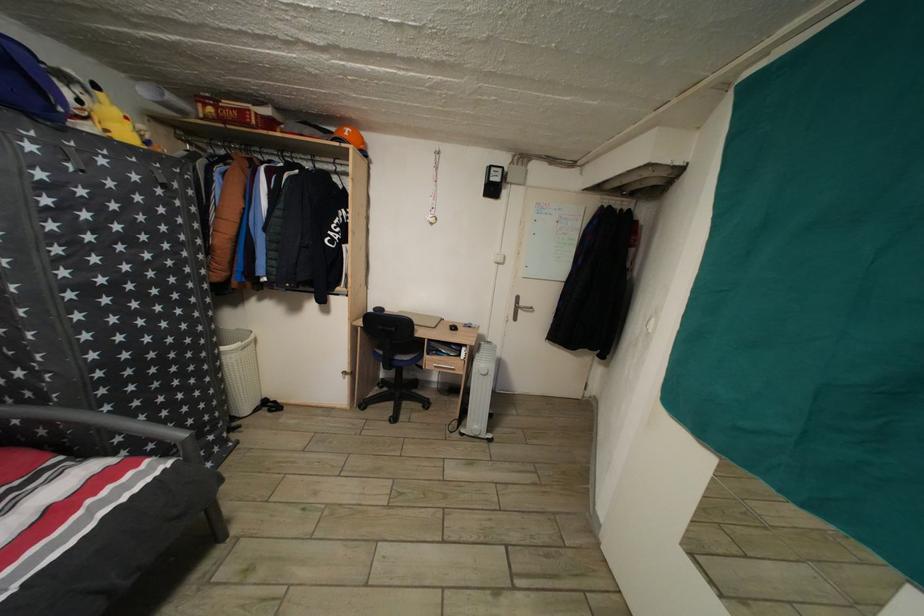
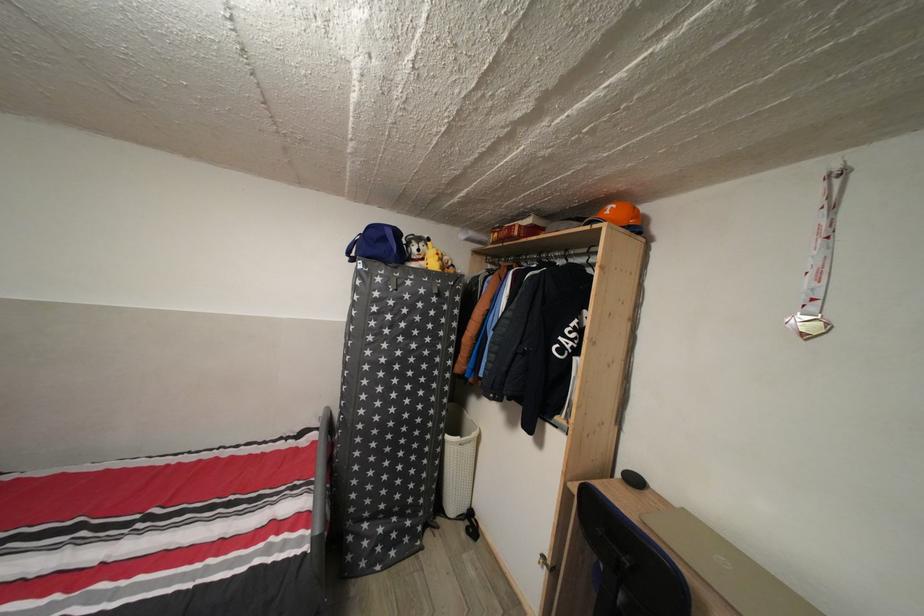
Question: The first image is from the beginning of the video and the second image is from the end. How did the camera likely rotate when shooting the video?

Choices:
 (A) Left
 (B) Right
 (C) Up
 (D) Down

Answer: (A)